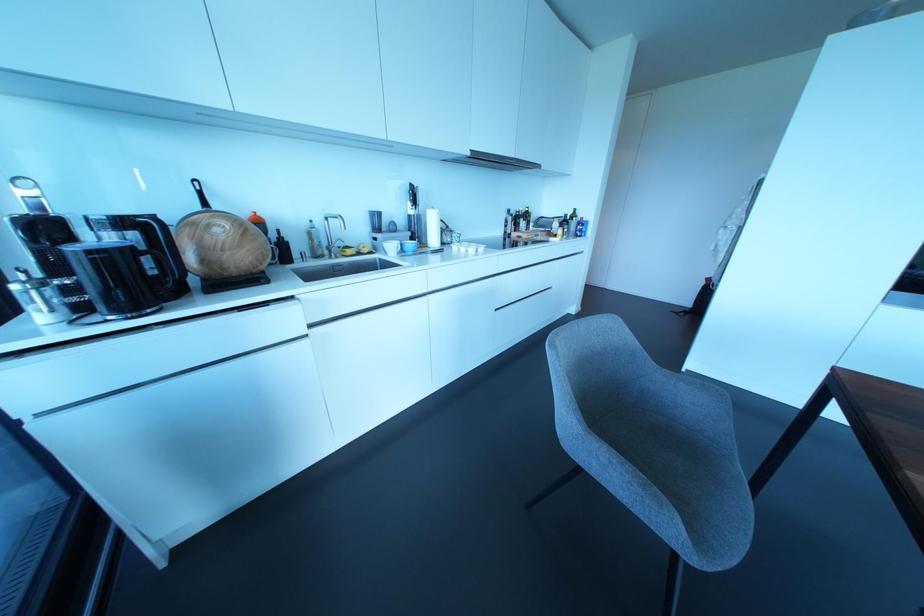
The image size is (924, 616). What do you see at coordinates (412, 214) in the screenshot? I see `the pump dispenser` at bounding box center [412, 214].